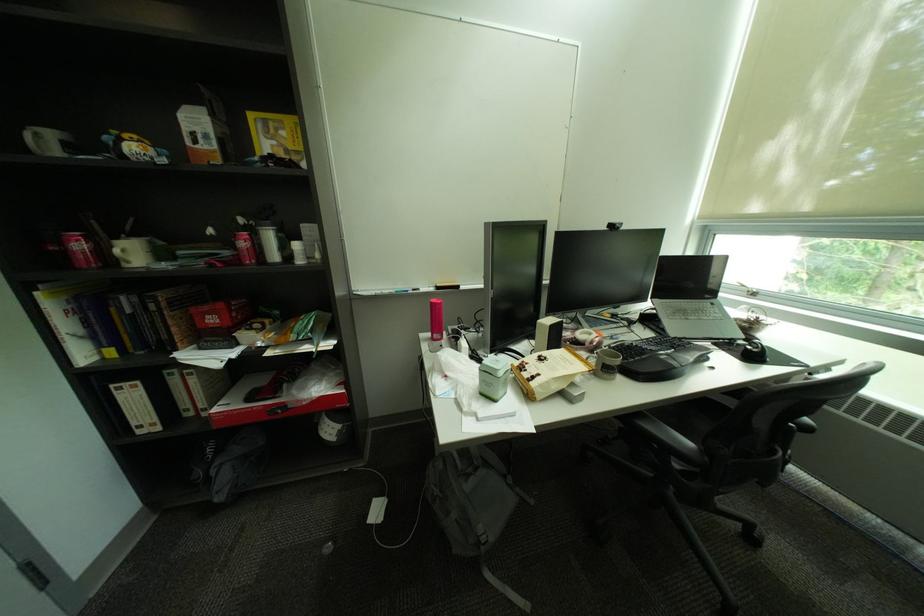
At what (x,y) coordinates should I click in order to perform the action: click on pink cylindrical bottle. Please return your answer as a coordinate pair (x, y). Looking at the image, I should click on (435, 323).